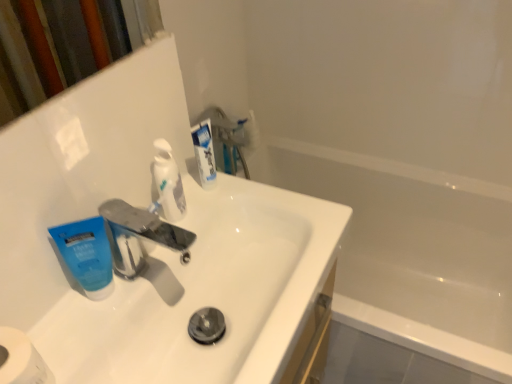
What are the coordinates of `free spot to the right of white glossy toothpaste at center, which ranks as the second toothpaste in right-to-left order` in the screenshot? It's located at (265, 214).